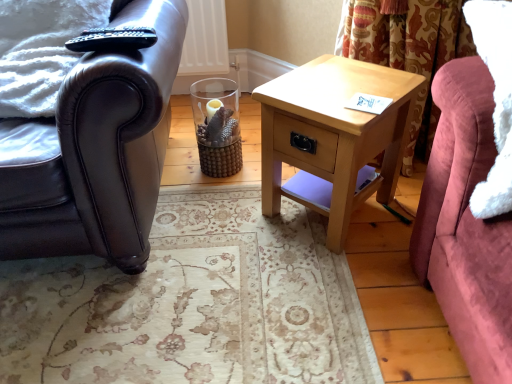
Question: Can you confirm if shiny black leather armchair at left is bigger than velvet pink couch at right?

Choices:
 (A) no
 (B) yes

Answer: (B)

Question: Is shiny black leather armchair at left positioned behind velvet pink couch at right?

Choices:
 (A) yes
 (B) no

Answer: (A)

Question: Considering the relative sizes of shiny black leather armchair at left and velvet pink couch at right in the image provided, is shiny black leather armchair at left shorter than velvet pink couch at right?

Choices:
 (A) no
 (B) yes

Answer: (A)

Question: Considering the relative positions of shiny black leather armchair at left and velvet pink couch at right in the image provided, is shiny black leather armchair at left to the right of velvet pink couch at right from the viewer's perspective?

Choices:
 (A) no
 (B) yes

Answer: (A)

Question: Does shiny black leather armchair at left appear on the left side of velvet pink couch at right?

Choices:
 (A) yes
 (B) no

Answer: (A)

Question: From the image's perspective, is shiny black leather armchair at left on top of velvet pink couch at right?

Choices:
 (A) no
 (B) yes

Answer: (B)

Question: Considering the relative sizes of shiny black leather armchair at left and light wood/texture nightstand at center in the image provided, is shiny black leather armchair at left smaller than light wood/texture nightstand at center?

Choices:
 (A) no
 (B) yes

Answer: (A)

Question: From a real-world perspective, is shiny black leather armchair at left located higher than light wood/texture nightstand at center?

Choices:
 (A) yes
 (B) no

Answer: (A)

Question: Are shiny black leather armchair at left and light wood/texture nightstand at center making contact?

Choices:
 (A) no
 (B) yes

Answer: (A)

Question: From a real-world perspective, is shiny black leather armchair at left physically below light wood/texture nightstand at center?

Choices:
 (A) yes
 (B) no

Answer: (B)

Question: Is shiny black leather armchair at left not near light wood/texture nightstand at center?

Choices:
 (A) yes
 (B) no

Answer: (B)

Question: Does shiny black leather armchair at left have a lesser width compared to light wood/texture nightstand at center?

Choices:
 (A) yes
 (B) no

Answer: (B)

Question: Considering the relative positions of light wood/texture nightstand at center and shiny black leather armchair at left in the image provided, is light wood/texture nightstand at center to the left of shiny black leather armchair at left from the viewer's perspective?

Choices:
 (A) yes
 (B) no

Answer: (B)